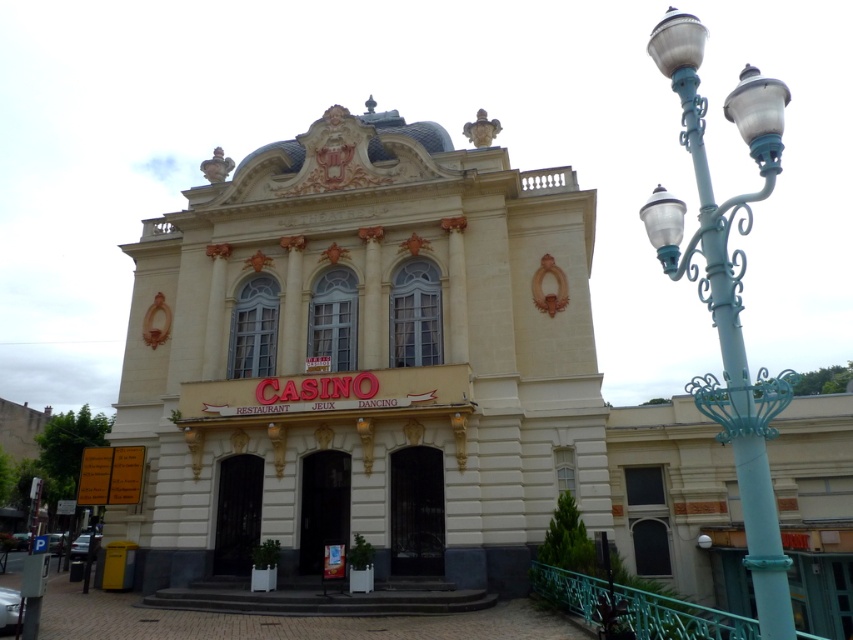
Question: Which object is closer to the camera taking this photo?

Choices:
 (A) white stone theater at center
 (B) black metal door at center

Answer: (A)

Question: Which point is closer to the camera?

Choices:
 (A) teal metal railing at lower center
 (B) black metal door at center
 (C) white stone theater at center

Answer: (A)

Question: In this image, where is teal metal/texture streetlamp at right located relative to black metal door at center?

Choices:
 (A) right
 (B) left

Answer: (A)

Question: Which point appears farthest from the camera in this image?

Choices:
 (A) (421, 529)
 (B) (759, 454)
 (C) (328, 465)

Answer: (C)

Question: Is teal metal/texture streetlamp at right to the left of dark glass door at center from the viewer's perspective?

Choices:
 (A) yes
 (B) no

Answer: (B)

Question: Does white stone theater at center have a larger size compared to black metal door at center?

Choices:
 (A) no
 (B) yes

Answer: (B)